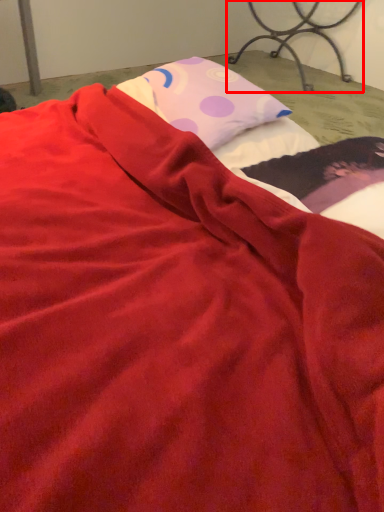
Question: Considering the relative positions of furniture (annotated by the red box) and pillow in the image provided, where is furniture (annotated by the red box) located with respect to the staircase?

Choices:
 (A) right
 (B) left

Answer: (A)